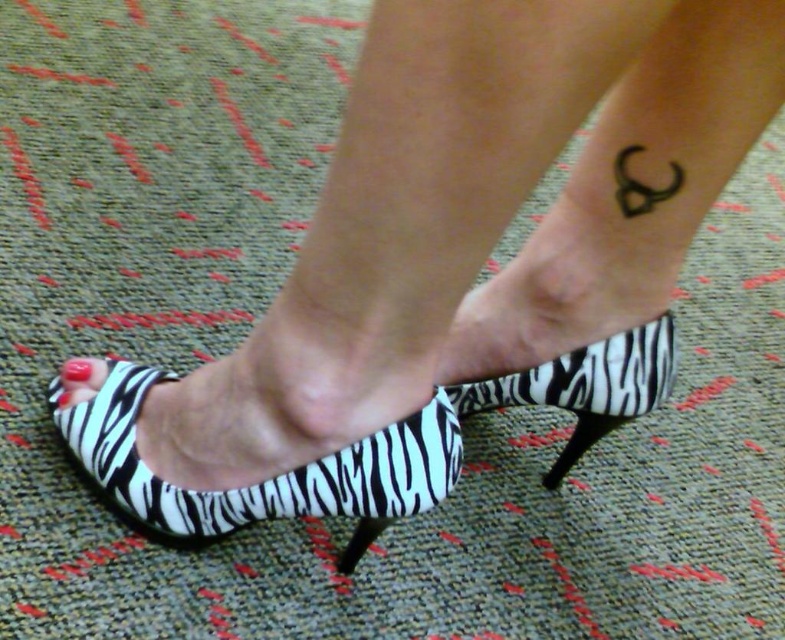
You are a photographer adjusting your camera to focus on the black ink tattoo at lower right and the zebra print heel at lower center. Which object should you focus on first to ensure it appears sharp in the photo?

The black ink tattoo at lower right is closer to the viewer than the zebra print heel at lower center, so you should focus on the black ink tattoo at lower right first to ensure it appears sharp.

You are a photographer taking a close up shot of a leg with a tattoo. The tattoo is the black ink tattoo at lower right. You want to focus on the tattoo and ensure it is in the frame. The camera has a focal length of 85mm. The minimum focusing distance is 2 feet. The subject is 23.62 inches away from the camera. Is the subject within the minimum focusing distance?

The subject is 23.62 inches away from the camera, which is less than the minimum focusing distance of 2 feet. Therefore, the camera cannot focus on the subject at this distance.